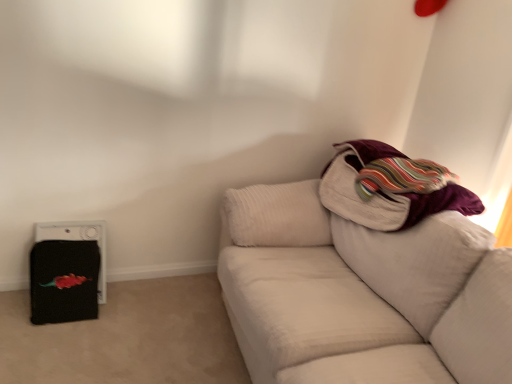
Question: From the image's perspective, is velvet purple blanket at upper right positioned above or below black fabric at left?

Choices:
 (A) above
 (B) below

Answer: (A)

Question: From a real-world perspective, is velvet purple blanket at upper right physically located above or below black fabric at left?

Choices:
 (A) below
 (B) above

Answer: (B)

Question: Based on their relative distances, which object is farther from the velvet purple blanket at upper right?

Choices:
 (A) white textured couch at right
 (B) black fabric at left

Answer: (B)

Question: Estimate the real-world distances between objects in this image. Which object is closer to the velvet purple blanket at upper right?

Choices:
 (A) black fabric at left
 (B) white textured couch at right

Answer: (B)